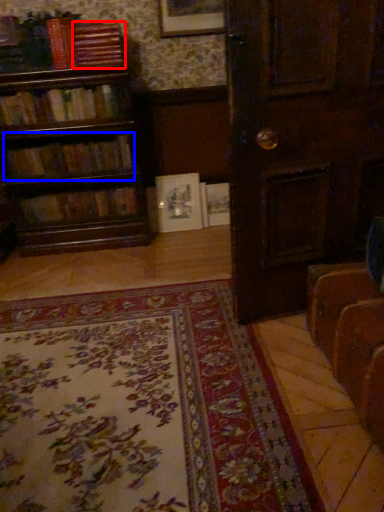
Question: Which point is further to the camera, book (highlighted by a red box) or book (highlighted by a blue box)?

Choices:
 (A) book
 (B) book

Answer: (B)